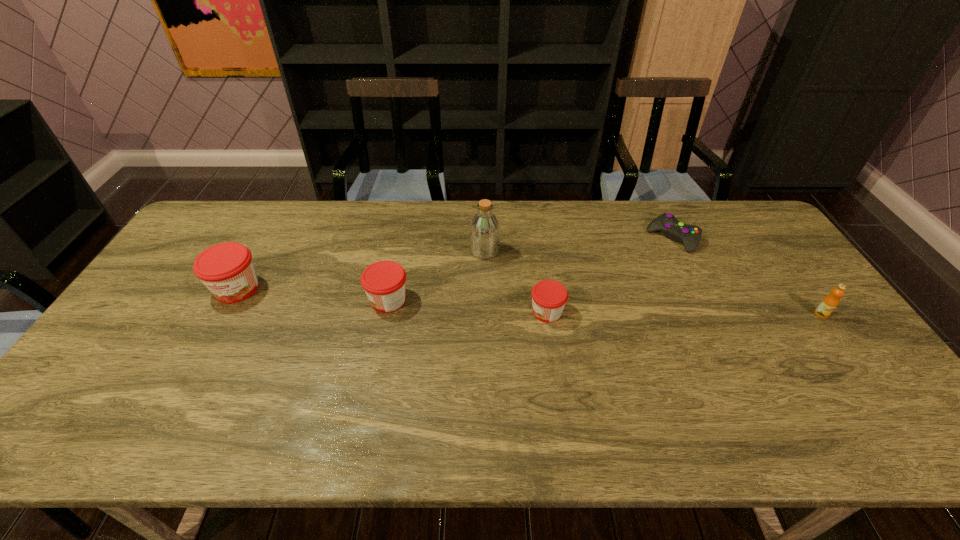
Locate an element on the screen. Image resolution: width=960 pixels, height=540 pixels. free space located on the front label of the orange juice is located at coordinates (851, 355).

Image resolution: width=960 pixels, height=540 pixels. I want to click on control at the far edge, so click(x=690, y=235).

Where is `bottle that is at the far edge`? This screenshot has width=960, height=540. bottle that is at the far edge is located at coordinates pos(484,230).

This screenshot has width=960, height=540. What are the coordinates of `object at the right edge` in the screenshot? It's located at (829, 303).

In the image, there is a desktop. Where is `free space at the far edge`? Image resolution: width=960 pixels, height=540 pixels. free space at the far edge is located at coordinates (351, 238).

Locate an element on the screen. The image size is (960, 540). blank space at the near edge of the desktop is located at coordinates [414, 389].

In the image, there is a desktop. What are the coordinates of `free region at the left edge` in the screenshot? It's located at (176, 313).

Find the location of a particular element. This screenshot has width=960, height=540. vacant region at the far left corner of the desktop is located at coordinates (217, 213).

Find the location of a particular element. free region at the near right corner of the desktop is located at coordinates (870, 374).

You are a GUI agent. You are given a task and a screenshot of the screen. Output one action in this format:
    pyautogui.click(x=<x>, y=<y>)
    Task: Click on the free space between the leftmost object and the fifth object from right to left
    The image size is (960, 540).
    Given the screenshot: What is the action you would take?
    pyautogui.click(x=313, y=294)